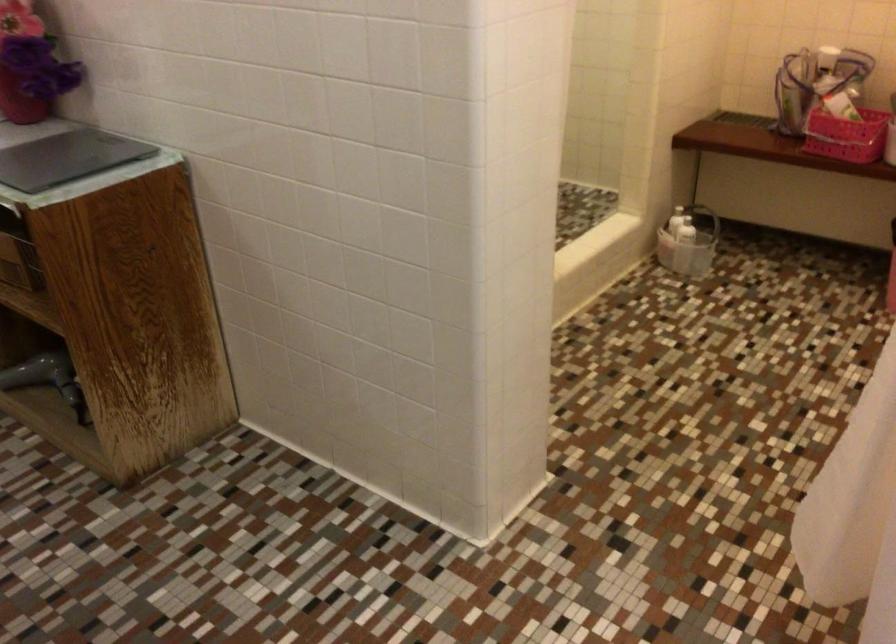
At what (x,y) coordinates should I click in order to perform the action: click on clear bag handle. Please return your answer as a coordinate pair (x, y). The height and width of the screenshot is (644, 896). Looking at the image, I should click on (815, 82).